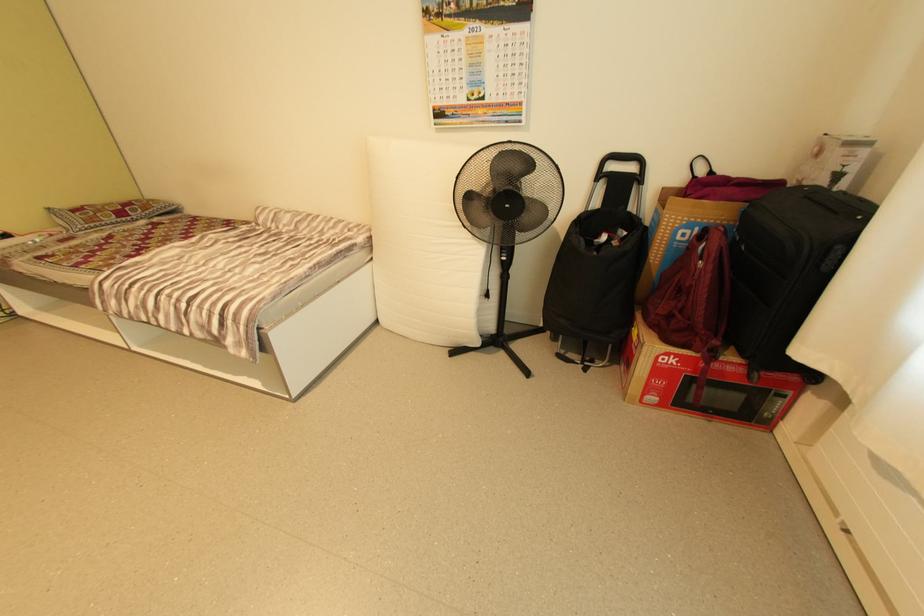
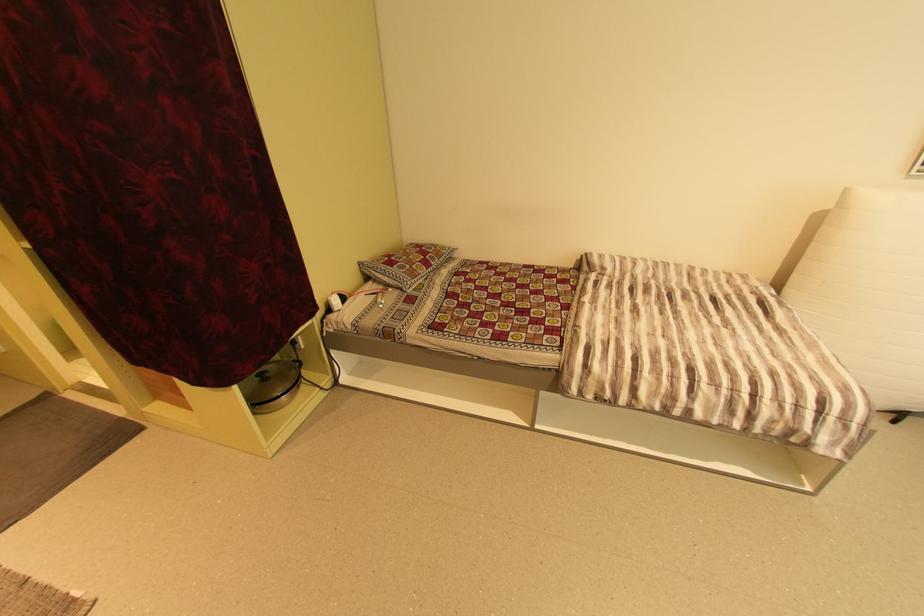
Question: Which direction would the cameraman need to move to produce the second image? Reply with the corresponding letter.

Choices:
 (A) Left
 (B) Right
 (C) Forward
 (D) Backward

Answer: (A)